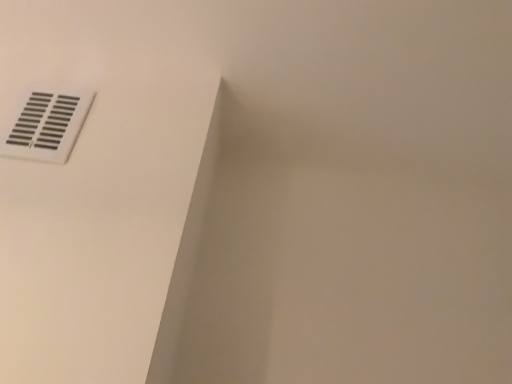
Image resolution: width=512 pixels, height=384 pixels. What do you see at coordinates (47, 124) in the screenshot?
I see `white plastic vent at upper left` at bounding box center [47, 124].

The image size is (512, 384). In order to click on white plastic vent at upper left in this screenshot , I will do `click(47, 124)`.

This screenshot has height=384, width=512. Identify the location of white plastic vent at upper left. (47, 124).